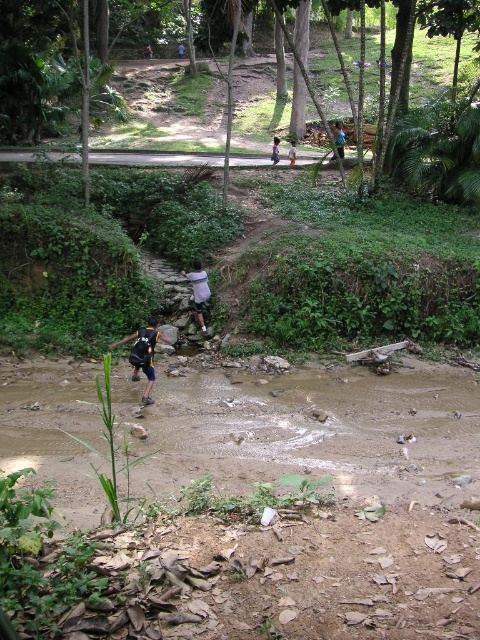
You are a GUI agent. You are given a task and a screenshot of the screen. Output one action in this format:
    pyautogui.click(x=<x>, y=<y>)
    Task: Click on the blue fabric shirt at center
    The width and height of the screenshot is (480, 640).
    Given the screenshot: What is the action you would take?
    pyautogui.click(x=337, y=138)

This screenshot has width=480, height=640. What do you see at coordinates (337, 138) in the screenshot?
I see `blue fabric shirt at center` at bounding box center [337, 138].

Who is more distant from viewer, (x=336, y=141) or (x=274, y=148)?

The point (x=274, y=148) is behind.

Identify the location of blue fabric shirt at center. (337, 138).

Which is in front, point (443, 488) or point (151, 387)?

Point (443, 488)

This screenshot has height=640, width=480. What are the coordinates of `brown muddy stream at lower center` in the screenshot? It's located at (311, 429).

Identify the location of brown muddy stream at lower center. This screenshot has width=480, height=640. (311, 429).

Can you confirm if brown muddy stream at lower center is shorter than blue fabric shirt at center?

Yes.

Between point (432, 499) and point (332, 131), which one is positioned in front?

Positioned in front is point (432, 499).

You are a GUI agent. You are given a task and a screenshot of the screen. Output one action in this format:
    pyautogui.click(x=<x>, y=<y>)
    Task: Click on the brown muddy stream at lower center
    
    Given the screenshot: What is the action you would take?
    pyautogui.click(x=311, y=429)